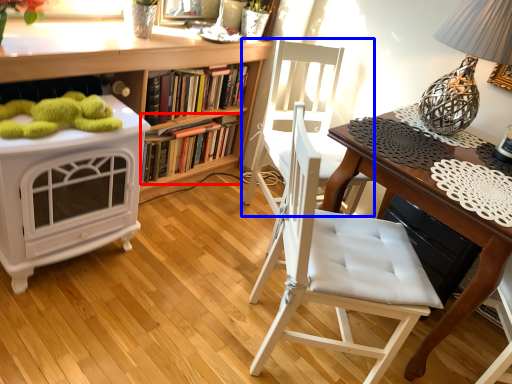
Question: Among these objects, which one is farthest to the camera, book (highlighted by a red box) or chair (highlighted by a blue box)?

Choices:
 (A) book
 (B) chair

Answer: (A)